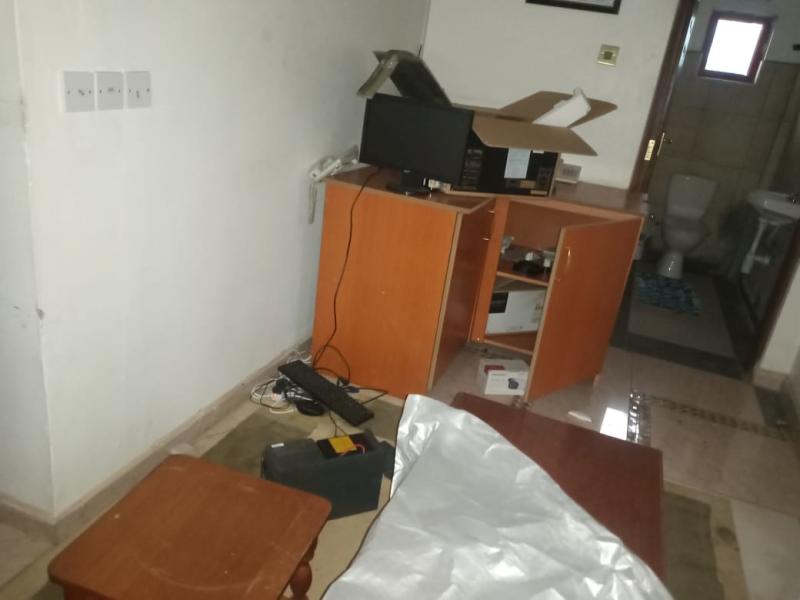
Locate an element on the screen. This screenshot has height=600, width=800. tile is located at coordinates (706, 464), (684, 349), (234, 443), (22, 561).